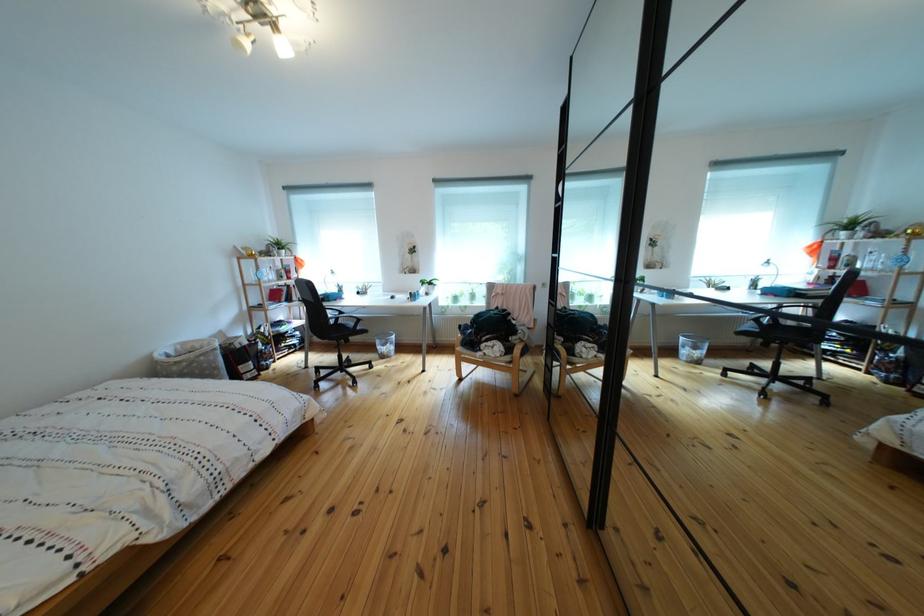
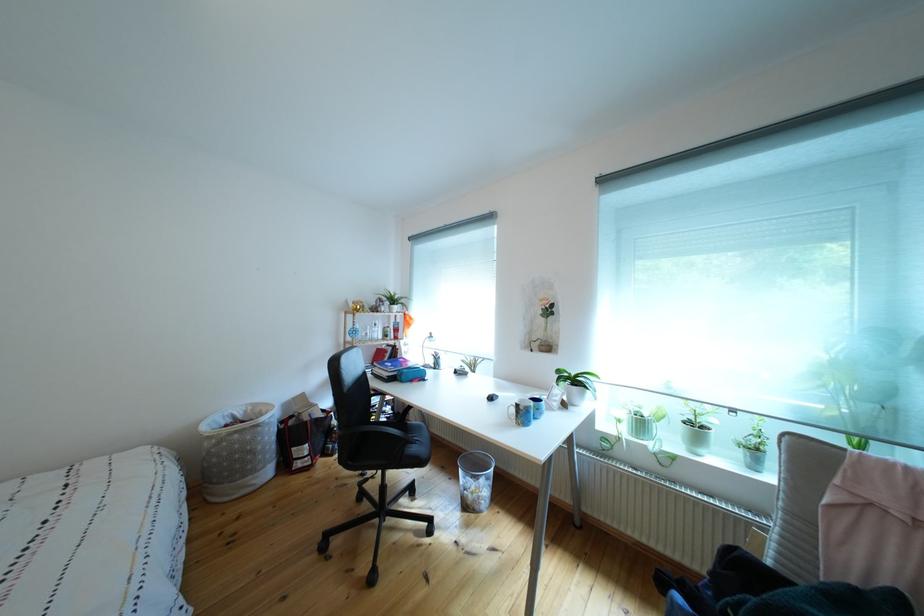
The point at [227,374] is marked in the first image. Where is the corresponding point in the second image?

(263, 456)